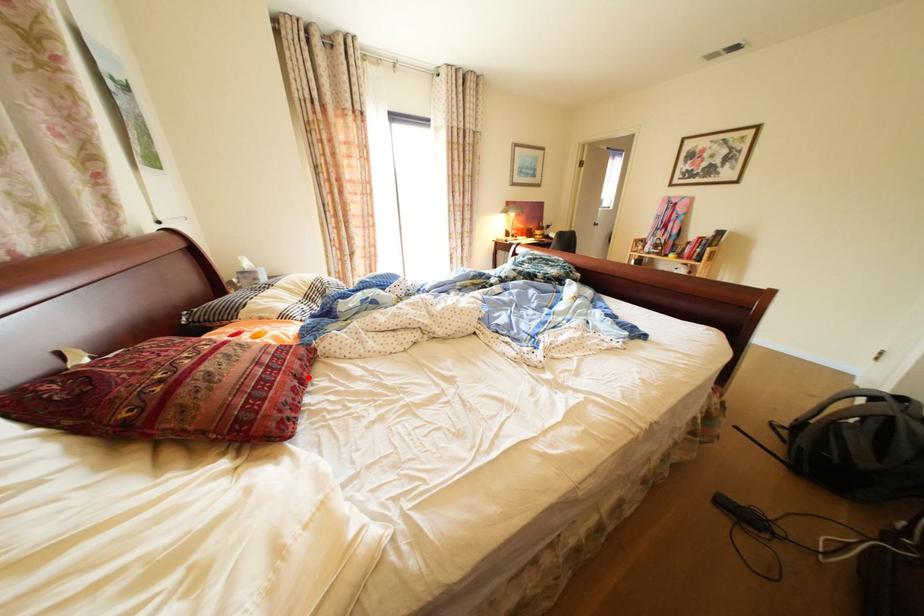
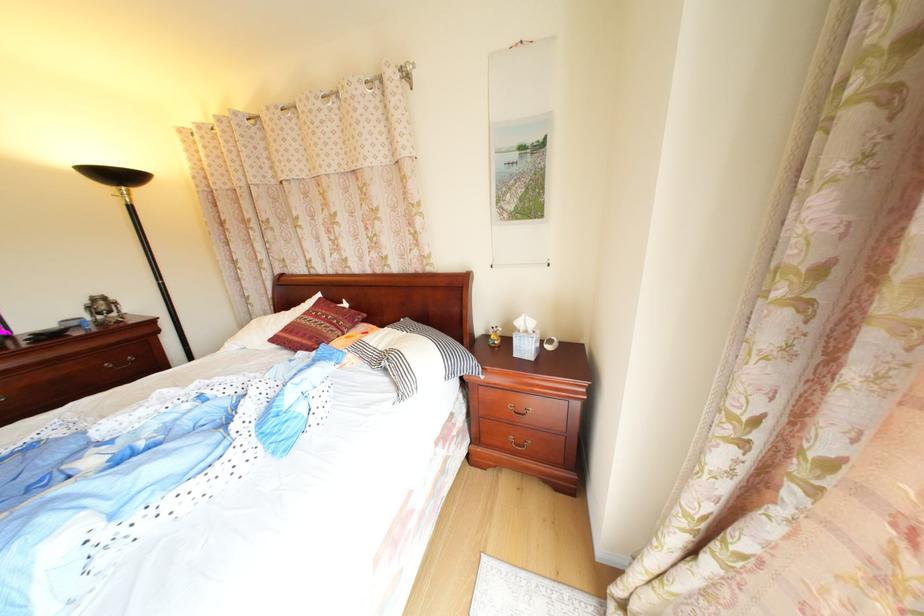
Where in the second image is the point corresponding to the highlighted location from the first image?

(304, 342)